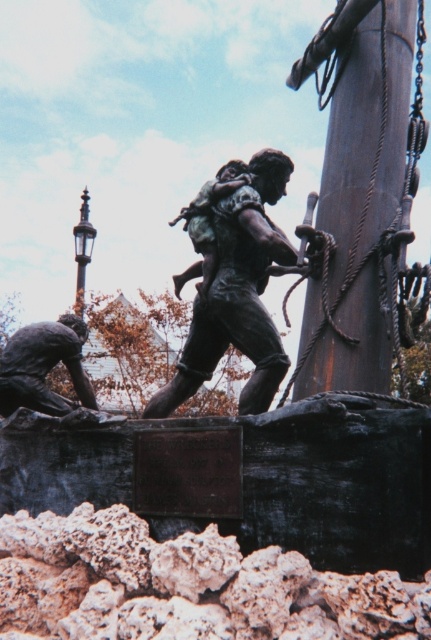
You are a photographer trying to capture the sculpture from a specific angle. You notice two points on the sculpture marked at coordinates point [387,136] and point [84,232]. Which point will appear larger in your photo?

Point [387,136] is closer to the camera than point [84,232], so it will appear larger in the photo.